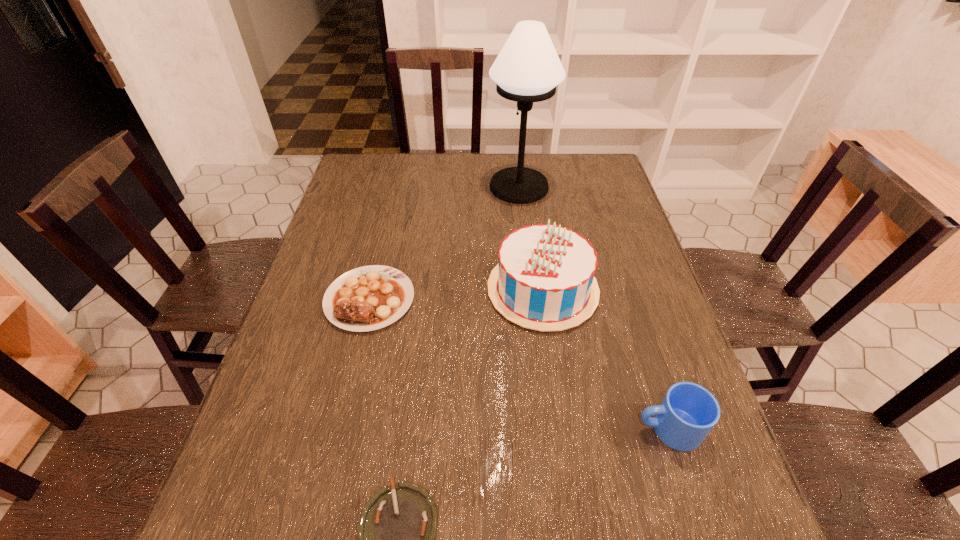
Where is `vacant region located 0.300m on the side of the mug with the handle`? vacant region located 0.300m on the side of the mug with the handle is located at coordinates (485, 429).

Identify the location of vacant region located 0.080m on the back of the steak. The image size is (960, 540). (381, 249).

Where is `object that is at the far edge`? object that is at the far edge is located at coordinates (528, 69).

I want to click on object that is positioned at the left edge, so click(x=368, y=298).

Locate an element on the screen. The width and height of the screenshot is (960, 540). birthday cake at the right edge is located at coordinates (544, 281).

What are the coordinates of `mug located at the right edge` in the screenshot? It's located at (688, 412).

The height and width of the screenshot is (540, 960). I want to click on vacant area at the far edge of the desktop, so click(x=408, y=158).

The image size is (960, 540). I want to click on blank space at the left edge of the desktop, so click(x=253, y=436).

Locate an element on the screen. This screenshot has height=540, width=960. free space at the right edge of the desktop is located at coordinates (591, 215).

Find the location of a particular element. This screenshot has width=960, height=540. blank space at the far right corner of the desktop is located at coordinates (584, 169).